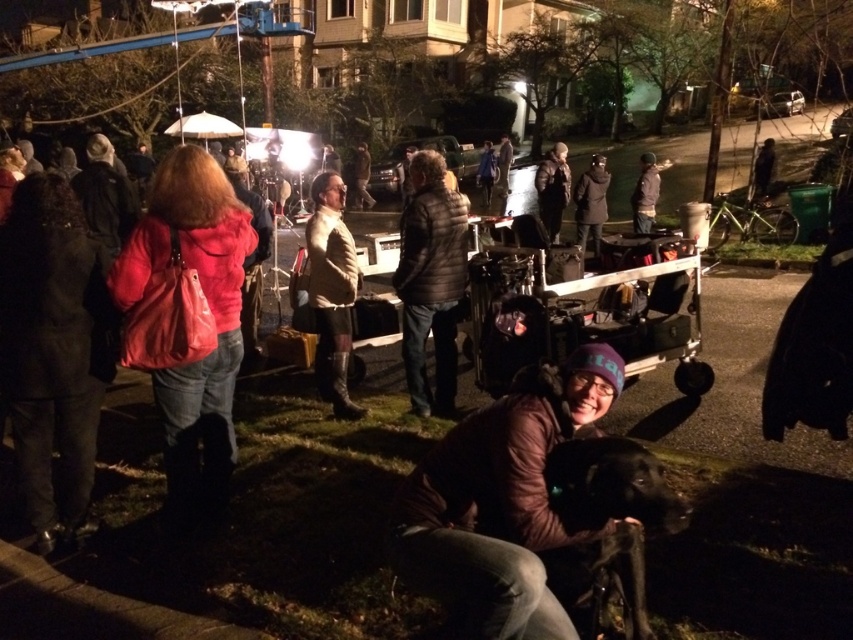
Question: Which point is farther from the camera taking this photo?

Choices:
 (A) (488, 340)
 (B) (553, 513)

Answer: (A)

Question: Can you confirm if brown leather jacket at lower center is positioned to the right of metallic silver cart at center?

Choices:
 (A) no
 (B) yes

Answer: (A)

Question: Can you confirm if brown leather jacket at lower center is thinner than metallic silver cart at center?

Choices:
 (A) no
 (B) yes

Answer: (B)

Question: Is brown leather jacket at lower center to the right of metallic silver cart at center from the viewer's perspective?

Choices:
 (A) yes
 (B) no

Answer: (B)

Question: Which object is closer to the camera taking this photo?

Choices:
 (A) metallic silver cart at center
 (B) brown leather jacket at lower center

Answer: (B)